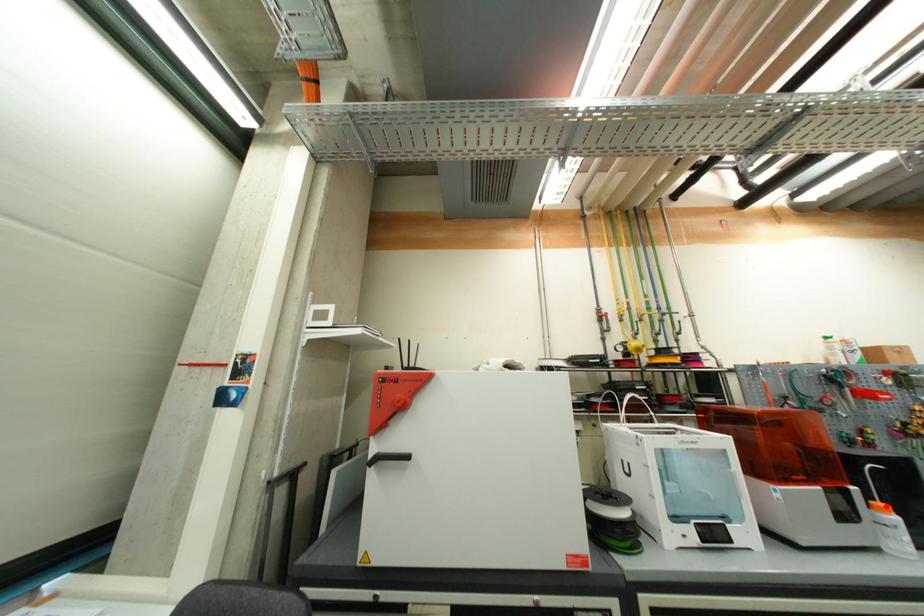
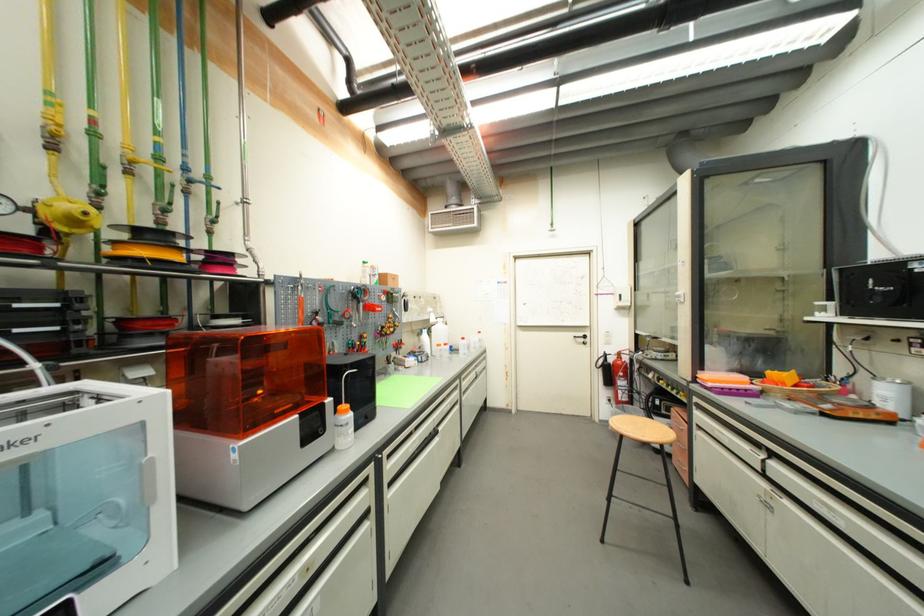
Question: A red point is marked in image1. In image2, is the corresponding 3D point closer to the camera or farther? Reply with the corresponding letter.

Choices:
 (A) The corresponding 3D point is closer.
 (B) The corresponding 3D point is farther.

Answer: (B)